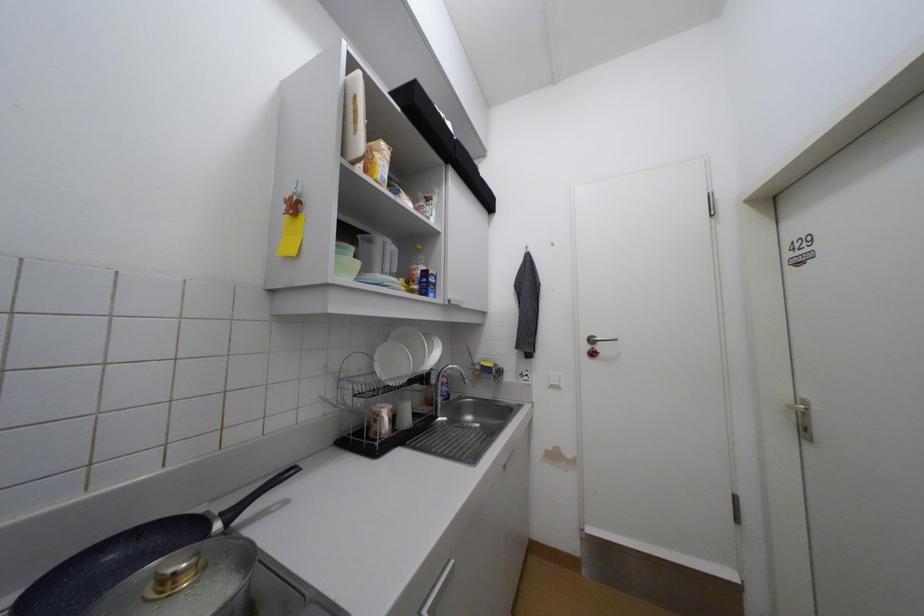
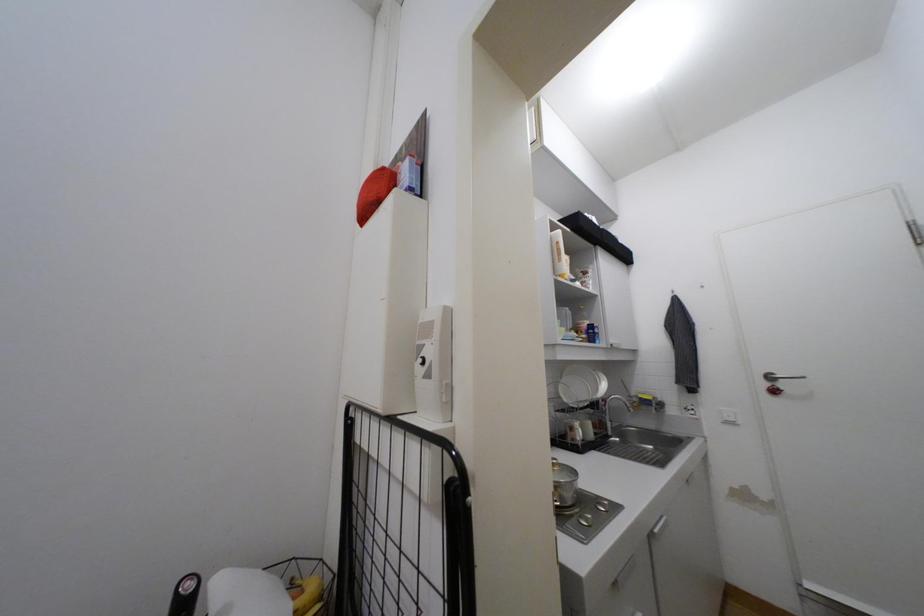
What movement of the cameraman would produce the second image?

The movement direction of the cameraman is left, backward.